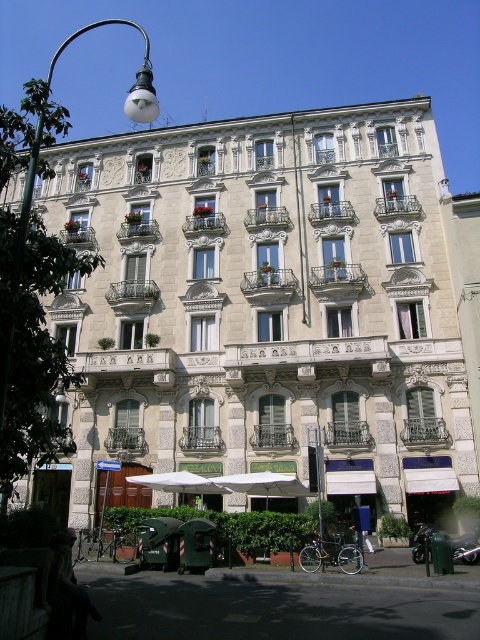
Based on the photo, can you confirm if white stone building at center is positioned above metallic streetlamp at left?

No, white stone building at center is not above metallic streetlamp at left.

Can you confirm if white stone building at center is positioned to the right of metallic streetlamp at left?

Correct, you'll find white stone building at center to the right of metallic streetlamp at left.

Does point (442, 202) come farther from viewer compared to point (96, 26)?

No, (442, 202) is in front of (96, 26).

I want to click on white stone building at center, so click(263, 312).